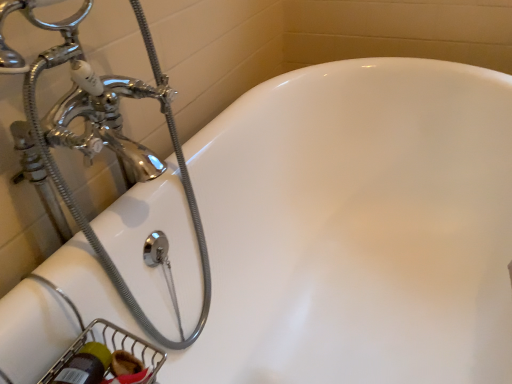
What do you see at coordinates (106, 139) in the screenshot?
I see `chrome/metallic faucet at upper left` at bounding box center [106, 139].

Where is `chrome/metallic faucet at upper left`? Image resolution: width=512 pixels, height=384 pixels. chrome/metallic faucet at upper left is located at coordinates (106, 139).

What is the approximate width of chrome/metallic faucet at upper left?

chrome/metallic faucet at upper left is 5.96 inches in width.

Measure the distance between point (177,141) and camera.

They are 31.42 inches apart.

Find the location of a particular element. The height and width of the screenshot is (384, 512). chrome/metallic faucet at upper left is located at coordinates (106, 139).